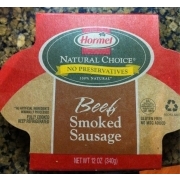
Where is `top visible portion of counter`? top visible portion of counter is located at coordinates (96, 7).